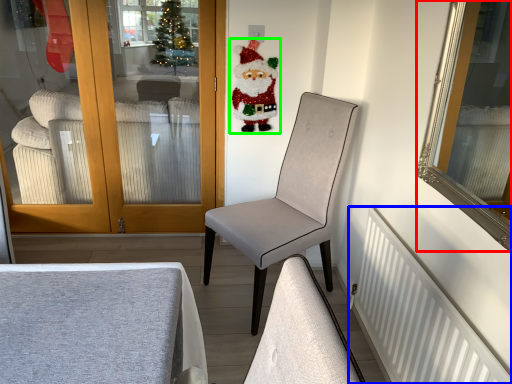
Question: Which object is positioned closest to mirror (highlighted by a red box)? Select from radiator (highlighted by a blue box) and santa claus (highlighted by a green box).

Choices:
 (A) radiator
 (B) santa claus

Answer: (B)